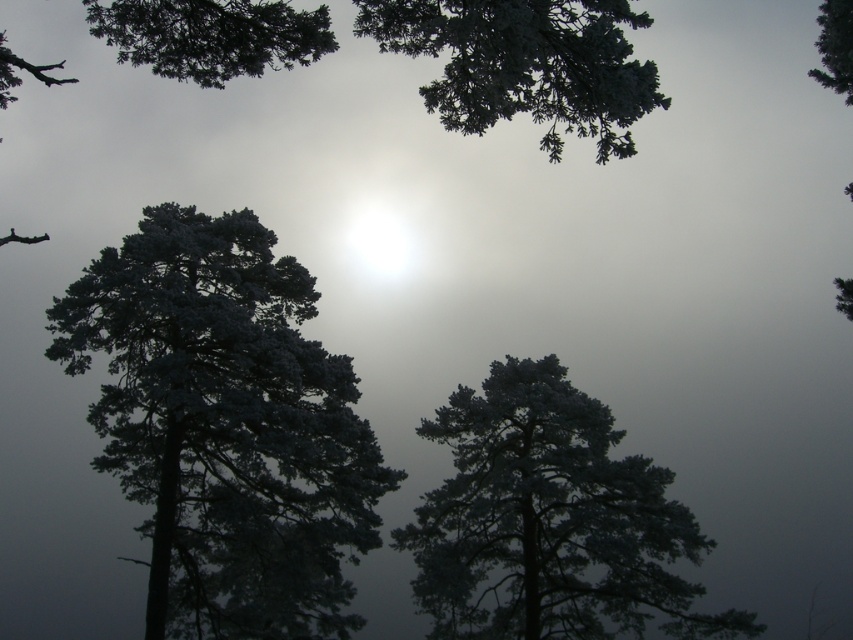
Question: Which point appears farthest from the camera in this image?

Choices:
 (A) (828, 77)
 (B) (300, 528)

Answer: (A)

Question: Which object is closer to the camera taking this photo?

Choices:
 (A) green matte tree at upper right
 (B) snowy pine tree at center
 (C) snow-covered pine tree at center

Answer: (A)

Question: Is snow-covered pine tree at center thinner than green matte tree at upper right?

Choices:
 (A) no
 (B) yes

Answer: (A)

Question: Is snow-covered pine tree at center thinner than snowy pine tree at center?

Choices:
 (A) yes
 (B) no

Answer: (A)

Question: Can you confirm if snow-covered pine tree at center is positioned to the right of green matte tree at upper right?

Choices:
 (A) yes
 (B) no

Answer: (B)

Question: Which object appears closest to the camera in this image?

Choices:
 (A) snowy pine tree at center
 (B) green matte tree at upper right

Answer: (B)